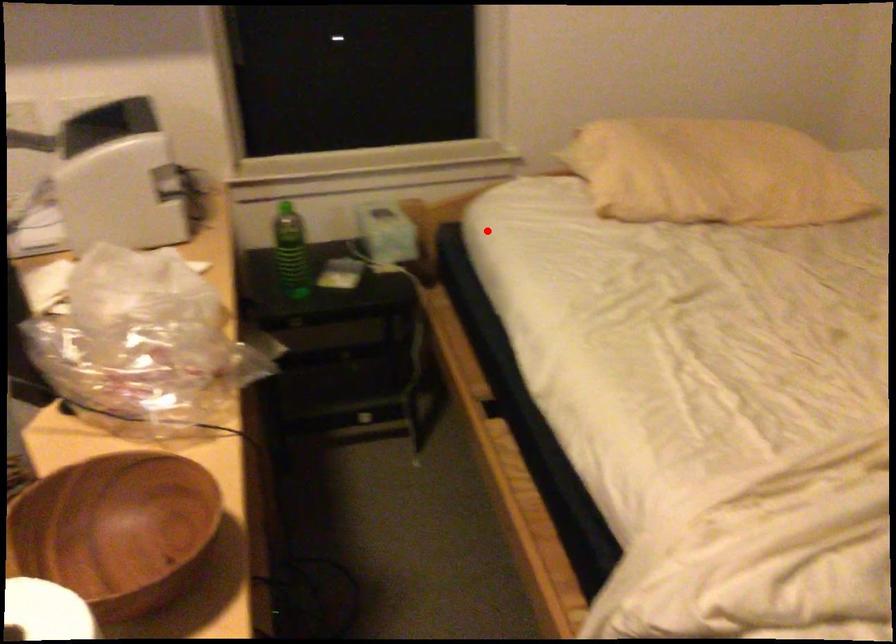
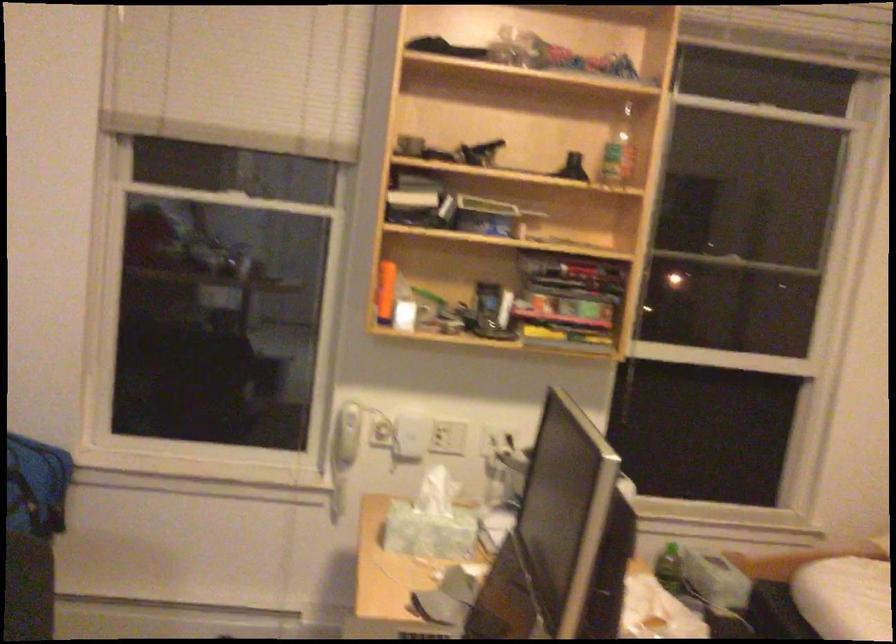
Find the pixel in the second image that matches the highlighted location in the first image.

(845, 598)